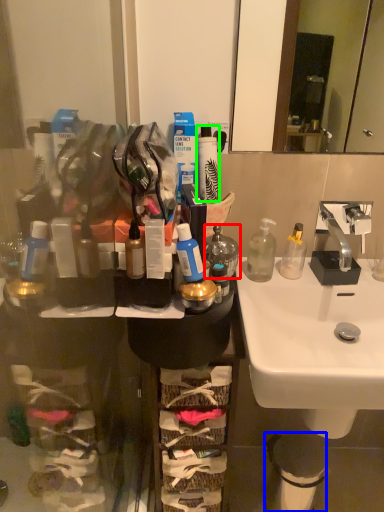
Question: Considering the real-world distances, which object is closest to bottle (highlighted by a red box)? trash bin/can (highlighted by a blue box) or toiletry (highlighted by a green box).

Choices:
 (A) trash bin/can
 (B) toiletry

Answer: (B)